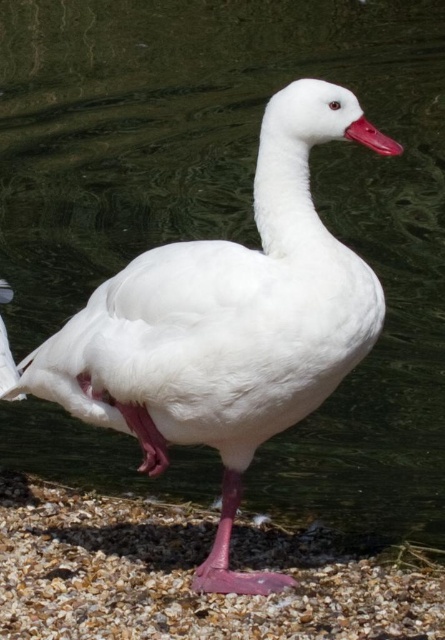
Does white feathered duck at center come in front of matte pink beak at center?

No, it is not.

Between white feathered duck at center and matte pink beak at center, which one has more height?

Standing taller between the two is white feathered duck at center.

Locate an element on the screen. The width and height of the screenshot is (445, 640). white feathered duck at center is located at coordinates [225, 326].

In the scene shown: Is smooth gravel at lower center to the right of matte pink beak at center from the viewer's perspective?

In fact, smooth gravel at lower center is to the left of matte pink beak at center.

Who is positioned more to the right, smooth gravel at lower center or matte pink beak at center?

matte pink beak at center is more to the right.

The image size is (445, 640). I want to click on smooth gravel at lower center, so click(x=190, y=573).

Locate an element on the screen. The image size is (445, 640). smooth gravel at lower center is located at coordinates (190, 573).

From the picture: Who is lower down, white feathered duck at center or smooth gravel at lower center?

smooth gravel at lower center is lower down.

Between white feathered duck at center and smooth gravel at lower center, which one has less height?

With less height is smooth gravel at lower center.

Is point (250, 420) in front of point (368, 580)?

Yes.

You are a GUI agent. You are given a task and a screenshot of the screen. Output one action in this format:
    pyautogui.click(x=<x>, y=<y>)
    Task: Click on the white feathered duck at center
    The height and width of the screenshot is (640, 445).
    Given the screenshot: What is the action you would take?
    pyautogui.click(x=225, y=326)